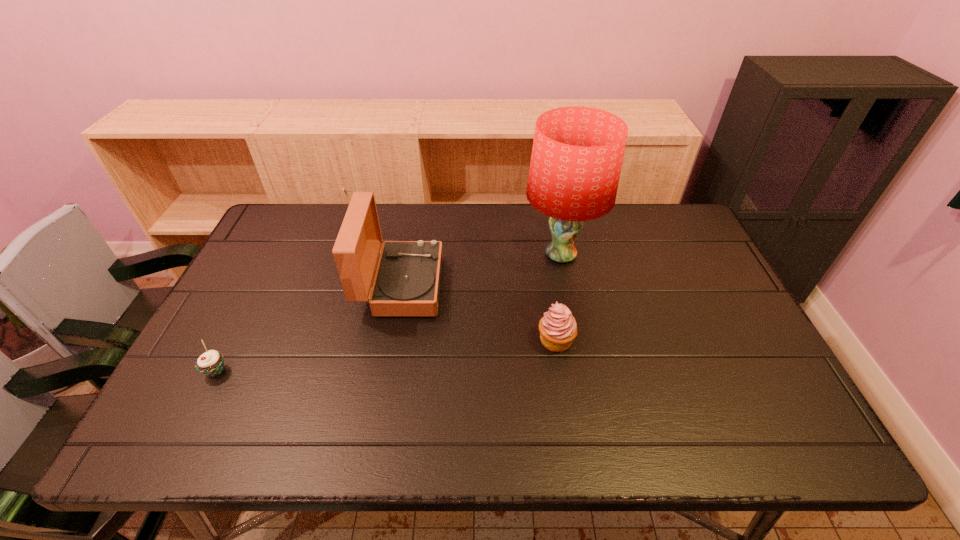
Where is `free space at the far right corner of the desktop`? free space at the far right corner of the desktop is located at coordinates (680, 233).

Image resolution: width=960 pixels, height=540 pixels. Find the location of `empty space that is in between the taller cupcake and the leftmost object`. empty space that is in between the taller cupcake and the leftmost object is located at coordinates (386, 355).

At what (x,y) coordinates should I click in order to perform the action: click on free point between the second tallest object and the lampshade. Please return your answer as a coordinate pair (x, y). This screenshot has width=960, height=540. Looking at the image, I should click on (481, 270).

I want to click on free spot between the third object from right to left and the tallest object, so click(x=481, y=270).

Locate an element on the screen. unoccupied area between the farther cupcake and the second object from left to right is located at coordinates (478, 313).

Locate an element on the screen. blank region between the lampshade and the third shortest object is located at coordinates (481, 270).

Where is `free space between the shorter cupcake and the second nearest object`? The image size is (960, 540). free space between the shorter cupcake and the second nearest object is located at coordinates (386, 355).

Locate an element on the screen. empty space that is in between the tallest object and the second tallest object is located at coordinates (481, 270).

Locate an element on the screen. empty space that is in between the third shortest object and the shortest object is located at coordinates (308, 328).

Locate which object is the closest to the left cupcake. Please provide its 2D coordinates. Your answer should be formatted as a tuple, i.e. [(x, y)], where the tuple contains the x and y coordinates of a point satisfying the conditions above.

[(407, 281)]